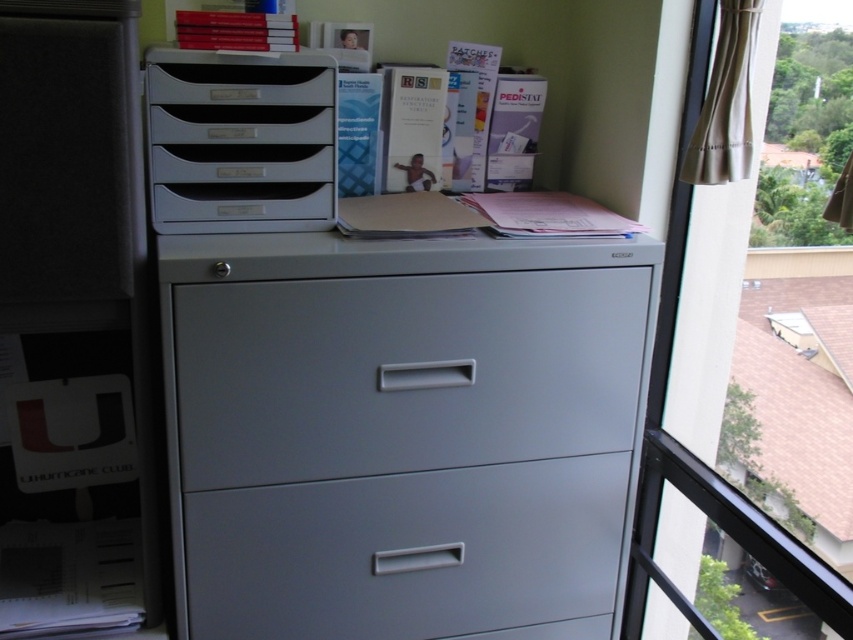
Question: Does satin gray drawer at center lie in front of matte plastic file cabinet at upper left?

Choices:
 (A) yes
 (B) no

Answer: (B)

Question: Among these objects, which one is farthest from the camera?

Choices:
 (A) transparent glass window at right
 (B) metallic gray drawer at center
 (C) satin gray drawer at center

Answer: (C)

Question: Does metallic gray drawer at center have a smaller size compared to matte plastic file cabinet at upper left?

Choices:
 (A) yes
 (B) no

Answer: (B)

Question: Which point is closer to the camera?

Choices:
 (A) satin gray drawer at center
 (B) gray matte/file cabinet at center

Answer: (B)

Question: Does gray matte/file cabinet at center have a lesser width compared to matte plastic file cabinet at upper left?

Choices:
 (A) no
 (B) yes

Answer: (A)

Question: Which object is positioned farthest from the transparent glass window at right?

Choices:
 (A) gray matte/file cabinet at center
 (B) matte plastic file cabinet at upper left
 (C) metallic gray drawer at center
 (D) satin gray drawer at center

Answer: (B)